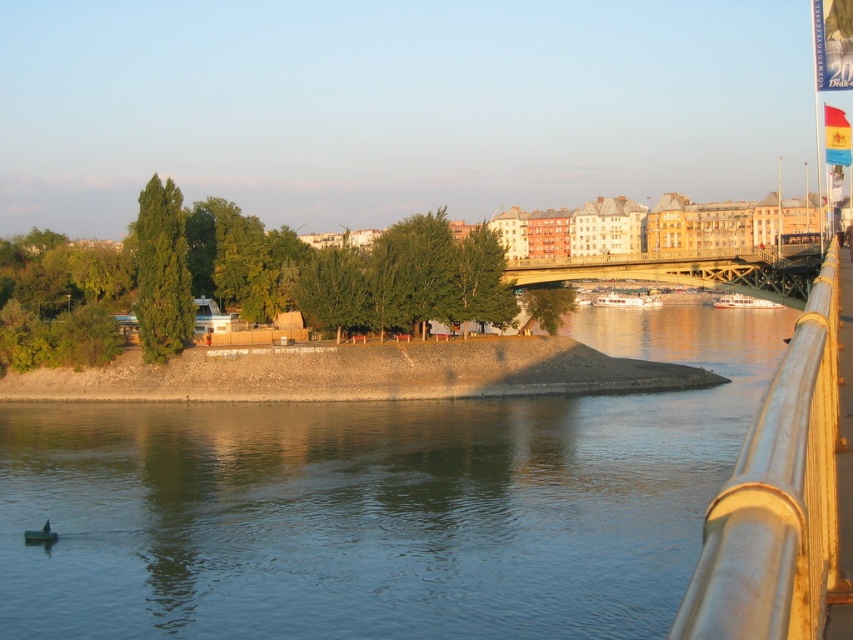
Is point (635, 401) behind point (634, 273)?

No, (635, 401) is closer to viewer.

Does blue water at lower left have a larger size compared to gold metallic bridge at center?

Yes.

Locate an element on the screen. Image resolution: width=853 pixels, height=640 pixels. blue water at lower left is located at coordinates (381, 502).

Identify the location of blue water at lower left. Image resolution: width=853 pixels, height=640 pixels. (381, 502).

Is blue water at lower left further to the viewer compared to metallic yellow railing at right?

Yes.

Between blue water at lower left and metallic yellow railing at right, which one appears on the left side from the viewer's perspective?

From the viewer's perspective, blue water at lower left appears more on the left side.

Is point (90, 616) closer to viewer compared to point (811, 481)?

No, it is not.

Image resolution: width=853 pixels, height=640 pixels. Identify the location of blue water at lower left. (381, 502).

Which of these two, metallic yellow railing at right or gold metallic bridge at center, stands taller?

metallic yellow railing at right

Can you confirm if metallic yellow railing at right is shorter than gold metallic bridge at center?

In fact, metallic yellow railing at right may be taller than gold metallic bridge at center.

What do you see at coordinates (779, 499) in the screenshot? This screenshot has width=853, height=640. I see `metallic yellow railing at right` at bounding box center [779, 499].

At what (x,y) coordinates should I click in order to perform the action: click on metallic yellow railing at right. Please return your answer as a coordinate pair (x, y). Looking at the image, I should click on (779, 499).